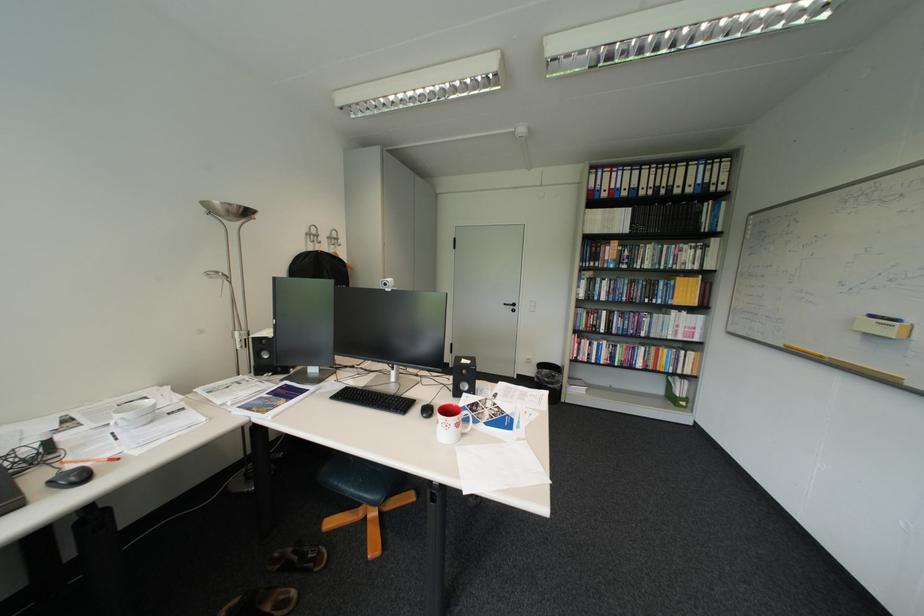
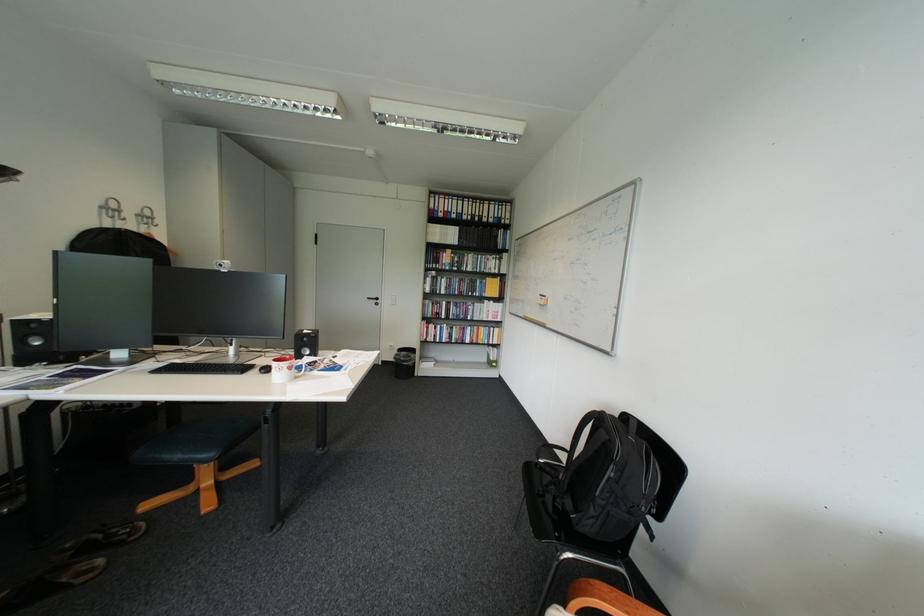
The point at (351, 485) is marked in the first image. Where is the corresponding point in the second image?

(176, 456)